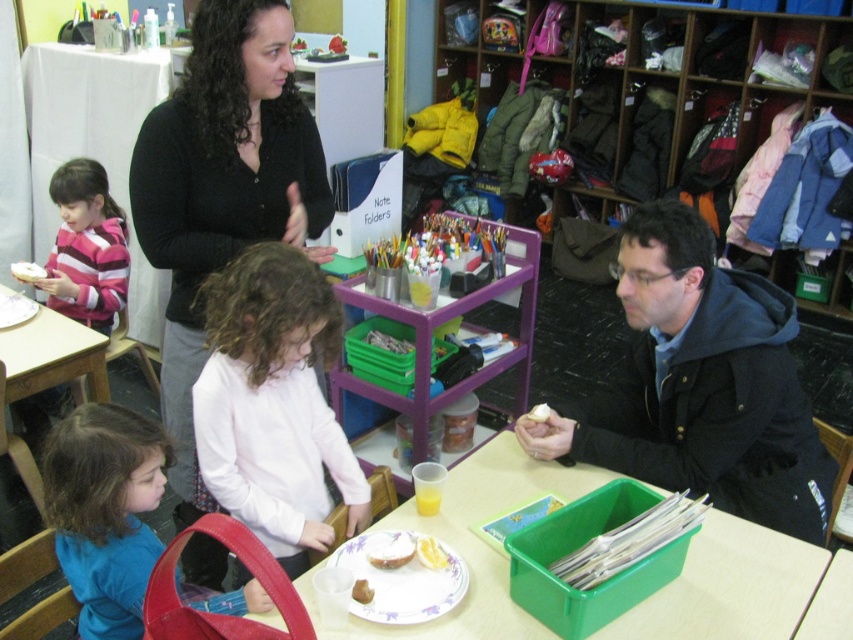
Is white matte shirt at center further to the viewer compared to blue fabric shirt at lower left?

That is True.

Does white matte shirt at center appear on the right side of blue fabric shirt at lower left?

Indeed, white matte shirt at center is positioned on the right side of blue fabric shirt at lower left.

Is point (311, 477) positioned behind point (109, 518)?

Yes, it is.

I want to click on white matte shirt at center, so click(274, 403).

Can you confirm if black matte jacket at lower right is positioned above white matte bread at left?

No, black matte jacket at lower right is not above white matte bread at left.

Between black matte jacket at lower right and white matte bread at left, which one has less height?

white matte bread at left is shorter.

Does point (720, 300) come closer to viewer compared to point (24, 278)?

That is True.

I want to click on black matte jacket at lower right, so click(x=700, y=385).

Who is positioned more to the left, white matte bread at left or white matte bread at lower center?

Positioned to the left is white matte bread at left.

The height and width of the screenshot is (640, 853). What do you see at coordinates (27, 272) in the screenshot?
I see `white matte bread at left` at bounding box center [27, 272].

Locate an element on the screen. This screenshot has height=640, width=853. white matte bread at left is located at coordinates (27, 272).

Locate an element on the screen. The image size is (853, 640). white matte bread at left is located at coordinates (27, 272).